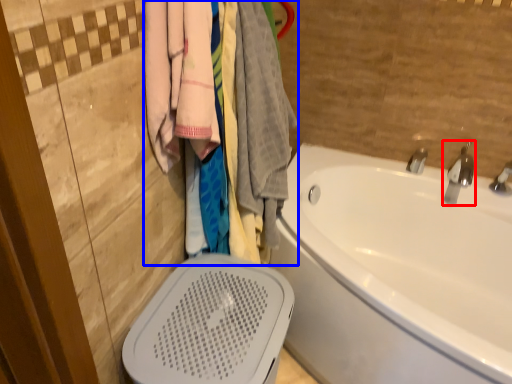
Question: Among these objects, which one is farthest to the camera, tap (highlighted by a red box) or closet (highlighted by a blue box)?

Choices:
 (A) tap
 (B) closet

Answer: (A)